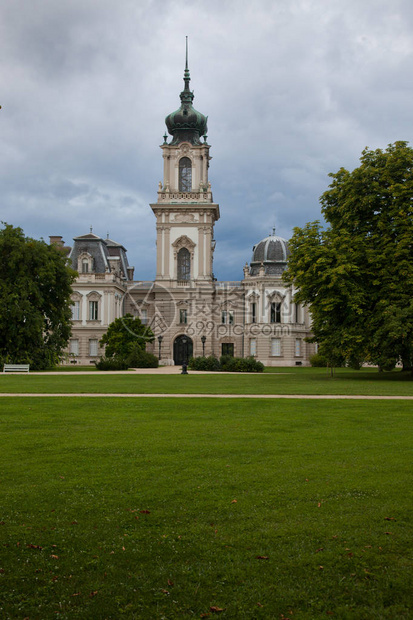
Identify the location of bench. This screenshot has width=413, height=620. (17, 366).